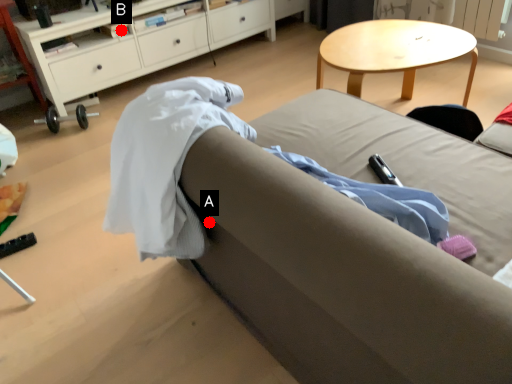
Question: Two points are circled on the image, labeled by A and B beside each circle. Which of the following is the closest to the observer?

Choices:
 (A) A is closer
 (B) B is closer

Answer: (A)